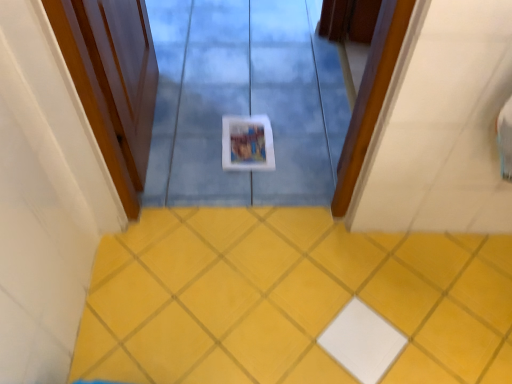
Question: From their relative heights in the image, would you say yellow matte tile at center is taller or shorter than wooden door at left?

Choices:
 (A) tall
 (B) short

Answer: (B)

Question: Based on their sizes in the image, would you say yellow matte tile at center is bigger or smaller than wooden door at left?

Choices:
 (A) small
 (B) big

Answer: (A)

Question: Is point (174, 259) closer or farther from the camera than point (157, 82)?

Choices:
 (A) farther
 (B) closer

Answer: (B)

Question: Considering their positions, is wooden door at left located in front of or behind yellow matte tile at center?

Choices:
 (A) behind
 (B) front

Answer: (B)

Question: Is wooden door at left wider or thinner than yellow matte tile at center?

Choices:
 (A) wide
 (B) thin

Answer: (B)

Question: Based on their sizes in the image, would you say wooden door at left is bigger or smaller than yellow matte tile at center?

Choices:
 (A) big
 (B) small

Answer: (A)

Question: From the image's perspective, is wooden door at left above or below yellow matte tile at center?

Choices:
 (A) above
 (B) below

Answer: (A)